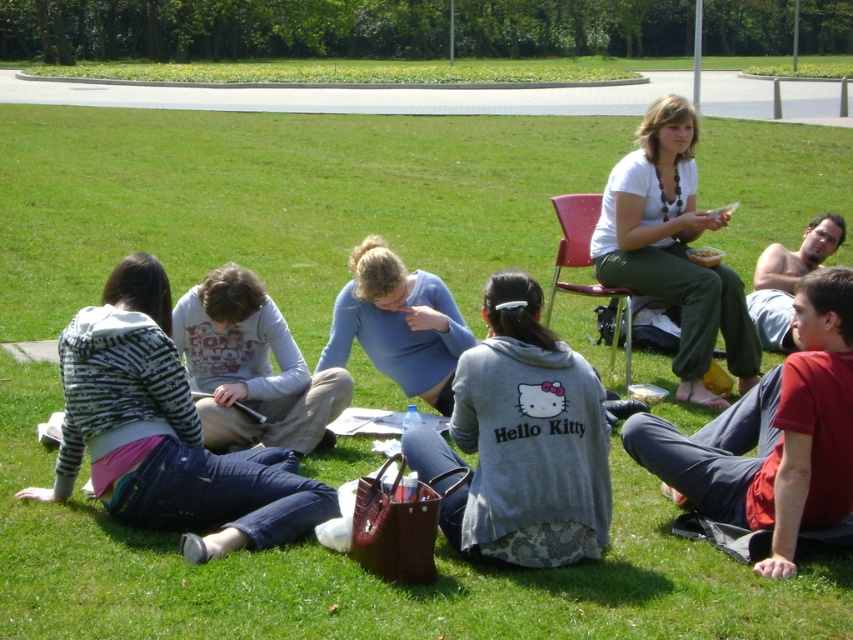
Is red cotton shirt at lower right below white cotton shirt at center?

Yes, red cotton shirt at lower right is below white cotton shirt at center.

Is red cotton shirt at lower right wider than white cotton shirt at center?

No.

Is point (706, 515) positioned in front of point (229, 362)?

Yes, it is in front of point (229, 362).

Identify the location of red cotton shirt at lower right. (772, 435).

Can you confirm if red cotton shirt at lower right is wider than plastic pink chair at upper right?

Yes, red cotton shirt at lower right is wider than plastic pink chair at upper right.

Does point (781, 388) come farther from viewer compared to point (589, 216)?

No.

Between point (838, 365) and point (576, 230), which one is positioned behind?

Point (576, 230)

Find the location of a particular element. The height and width of the screenshot is (640, 853). red cotton shirt at lower right is located at coordinates pos(772,435).

Which is above, white matte shirt at upper right or shirtless skin at upper right?

white matte shirt at upper right is higher up.

Does white matte shirt at upper right have a larger size compared to shirtless skin at upper right?

Indeed, white matte shirt at upper right has a larger size compared to shirtless skin at upper right.

Find the location of `white matte shirt at upper right`. white matte shirt at upper right is located at coordinates (672, 250).